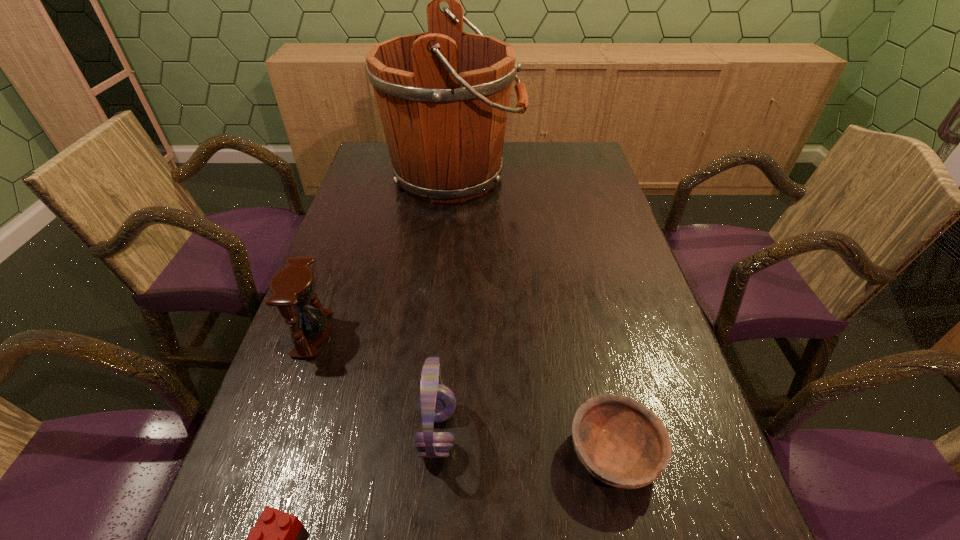
Find the location of a particular element. unoccupied area between the bucket and the hourglass is located at coordinates (383, 254).

Where is `vacant space that's between the hourglass and the bowl`? vacant space that's between the hourglass and the bowl is located at coordinates (463, 394).

Identify the location of free point between the headset and the bowl. (525, 443).

The width and height of the screenshot is (960, 540). I want to click on vacant point located between the hourglass and the bucket, so click(383, 254).

This screenshot has height=540, width=960. In order to click on free space that is in between the second farthest object and the farthest object in this screenshot , I will do `click(383, 254)`.

Locate an element on the screen. object that is the second closest to the headset is located at coordinates (622, 443).

What are the coordinates of `object that is the closest one to the tallest object` in the screenshot? It's located at (293, 286).

The width and height of the screenshot is (960, 540). Identify the location of free point that satisfies the following two spatial constraints: 1. on the headband and ear cups of the second shortest object; 2. on the left side of the headset. (435, 454).

Where is `free space that satisfies the following two spatial constraints: 1. on the front side of the second farthest object; 2. on the left side of the rightmost object`? free space that satisfies the following two spatial constraints: 1. on the front side of the second farthest object; 2. on the left side of the rightmost object is located at coordinates (269, 454).

I want to click on blank area in the image that satisfies the following two spatial constraints: 1. on the headband and ear cups of the second shortest object; 2. on the left side of the headset, so click(435, 454).